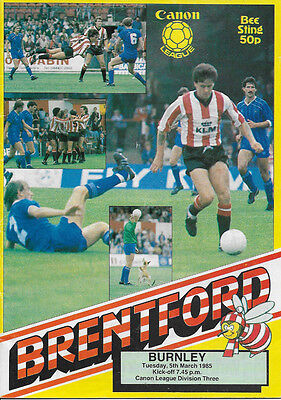
Where is `sports magazine`? sports magazine is located at coordinates (113, 283).